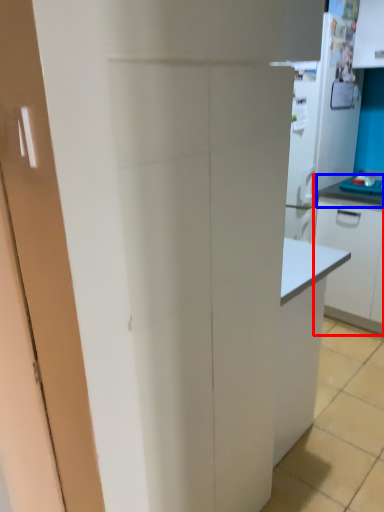
Question: Which object appears farthest to the camera in this image, cabinetry (highlighted by a red box) or countertop (highlighted by a blue box)?

Choices:
 (A) cabinetry
 (B) countertop

Answer: (B)